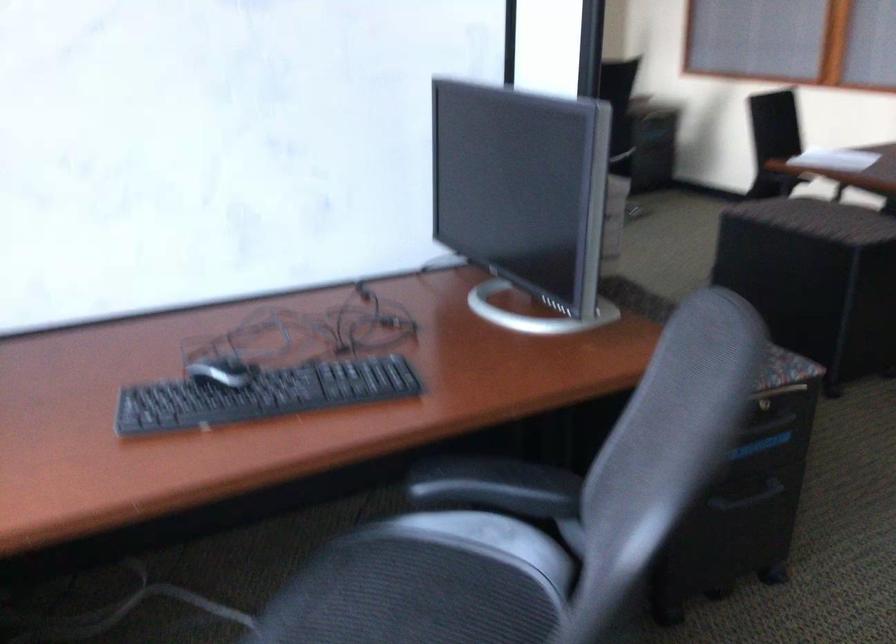
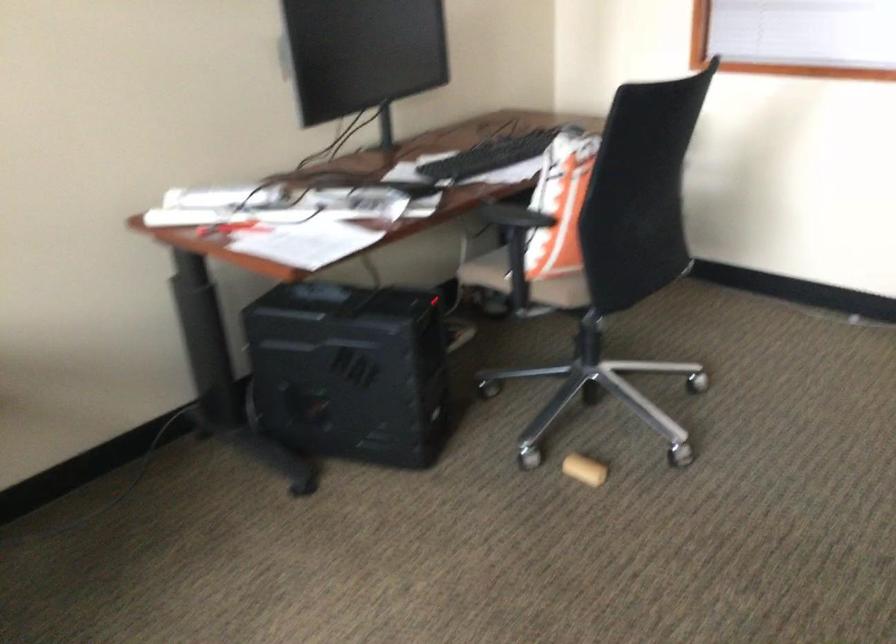
Question: In a continuous first-person perspective shot, in which direction is the camera moving?

Choices:
 (A) Left
 (B) Right
 (C) Forward
 (D) Backward

Answer: (C)